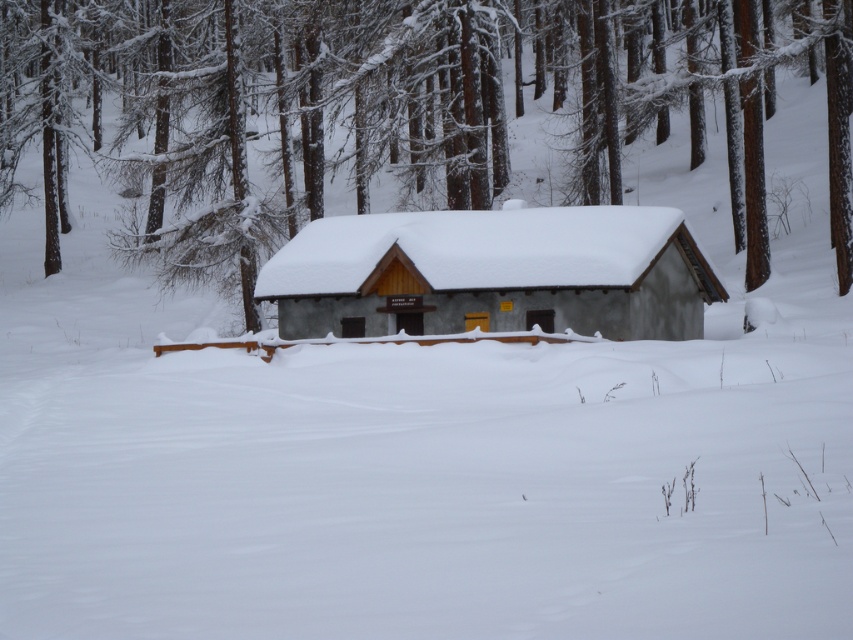
Question: Can you confirm if brown wood tree at center is bigger than smooth gray cabin at center?

Choices:
 (A) yes
 (B) no

Answer: (A)

Question: Can you confirm if brown wood tree at center is smaller than smooth gray cabin at center?

Choices:
 (A) yes
 (B) no

Answer: (B)

Question: Among these points, which one is farthest from the camera?

Choices:
 (A) (390, 96)
 (B) (697, 252)

Answer: (A)

Question: Which point appears farthest from the camera in this image?

Choices:
 (A) (445, 332)
 (B) (202, 252)

Answer: (B)

Question: Among these points, which one is farthest from the camera?

Choices:
 (A) (212, 205)
 (B) (283, 326)

Answer: (A)

Question: Does brown wood tree at center appear on the left side of smooth gray cabin at center?

Choices:
 (A) no
 (B) yes

Answer: (B)